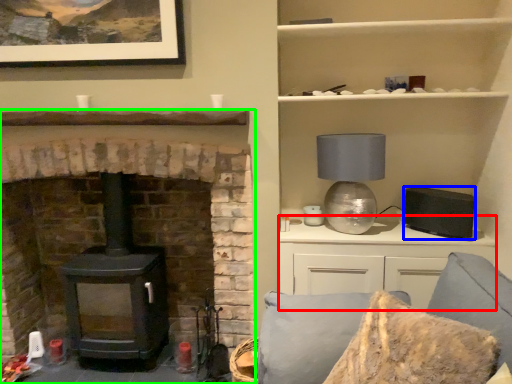
Question: Considering the real-world distances, which object is closest to entertainment center (highlighted by a red box)? appliance (highlighted by a blue box) or fireplace (highlighted by a green box).

Choices:
 (A) appliance
 (B) fireplace

Answer: (A)